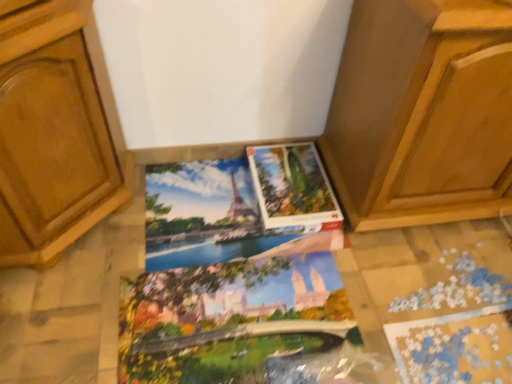
At what (x,y) coordinates should I click in order to perform the action: click on free spot to the left of matte paper coloring book at center, marked as the first coloring book in a bottom-to-top arrangement. Please return your answer as a coordinate pair (x, y). Looking at the image, I should click on (84, 292).